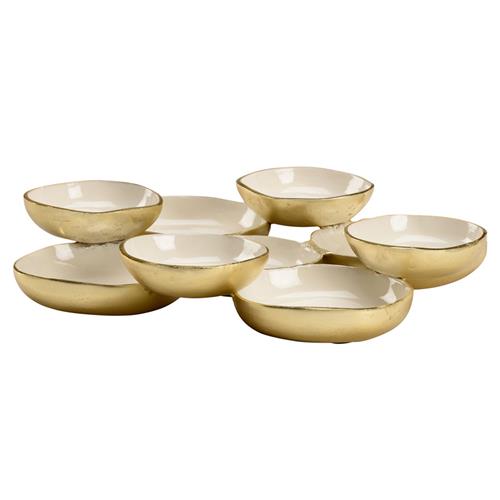
Find the location of a particular element. This screenshot has height=500, width=500. inside of bowls is located at coordinates (165, 254), (89, 274), (75, 192), (204, 215), (286, 187), (326, 293), (404, 231), (280, 254), (332, 242).